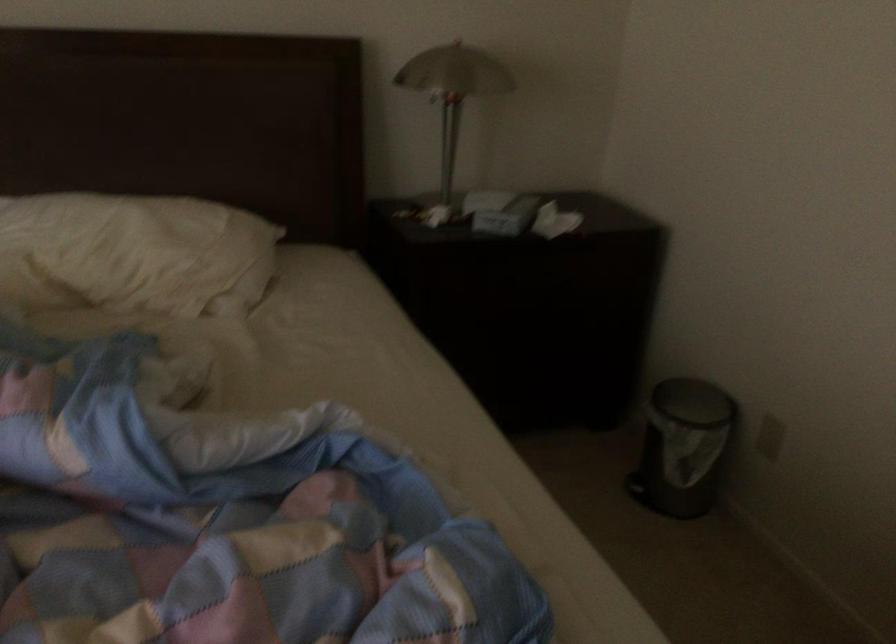
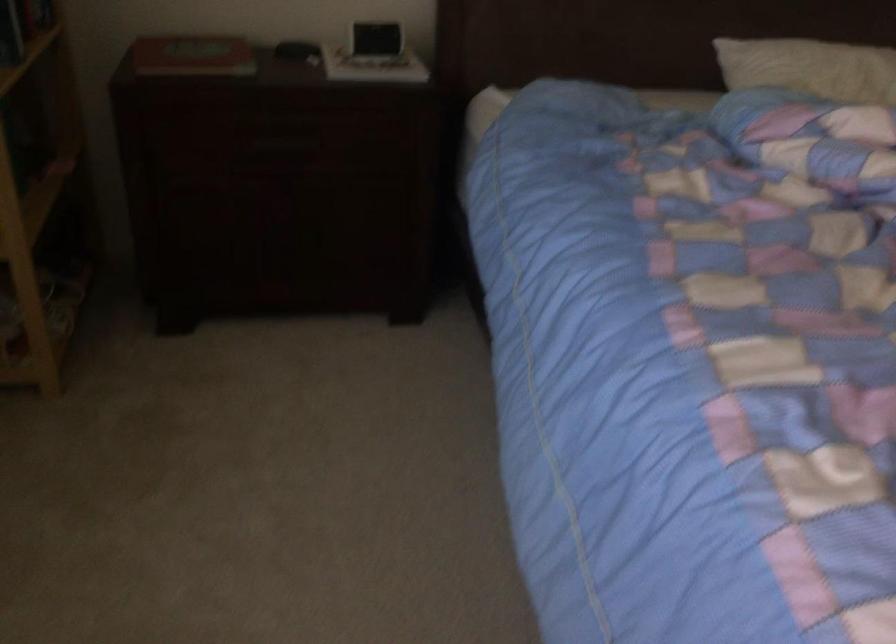
Which direction would the cameraman need to move to produce the second image?

The movement direction of the cameraman is left, backward.